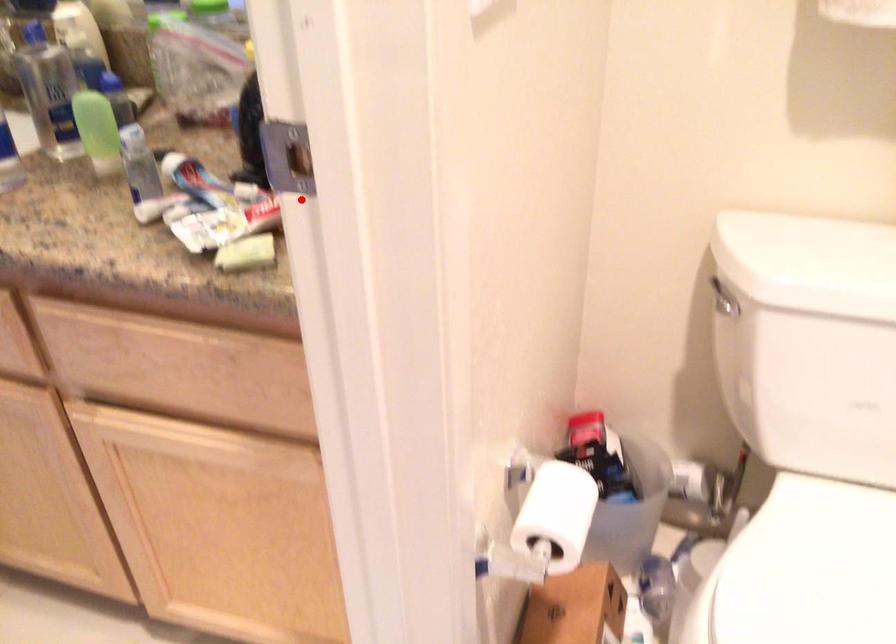
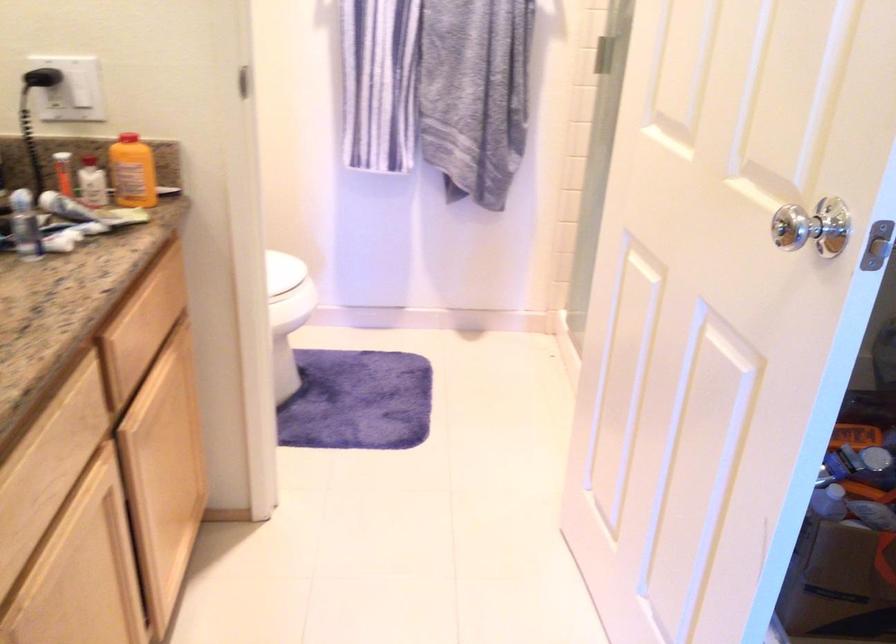
Find the pixel in the second image that matches the highlighted location in the first image.

(133, 172)